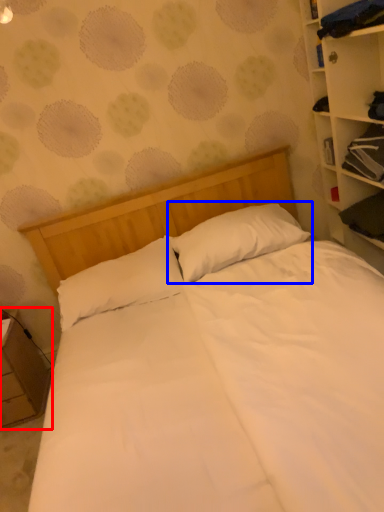
Question: Which object appears farthest to the camera in this image, nightstand (highlighted by a red box) or pillow (highlighted by a blue box)?

Choices:
 (A) nightstand
 (B) pillow

Answer: (A)